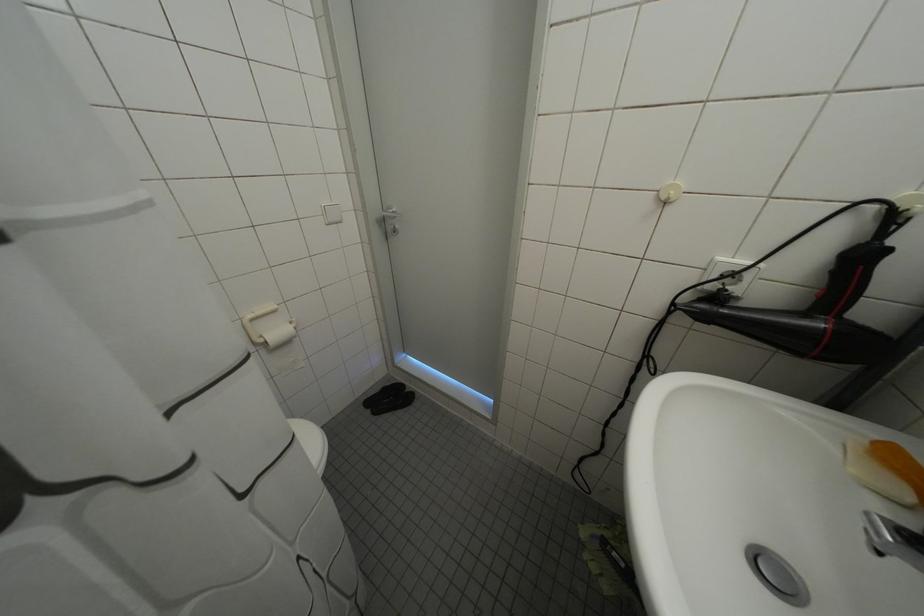
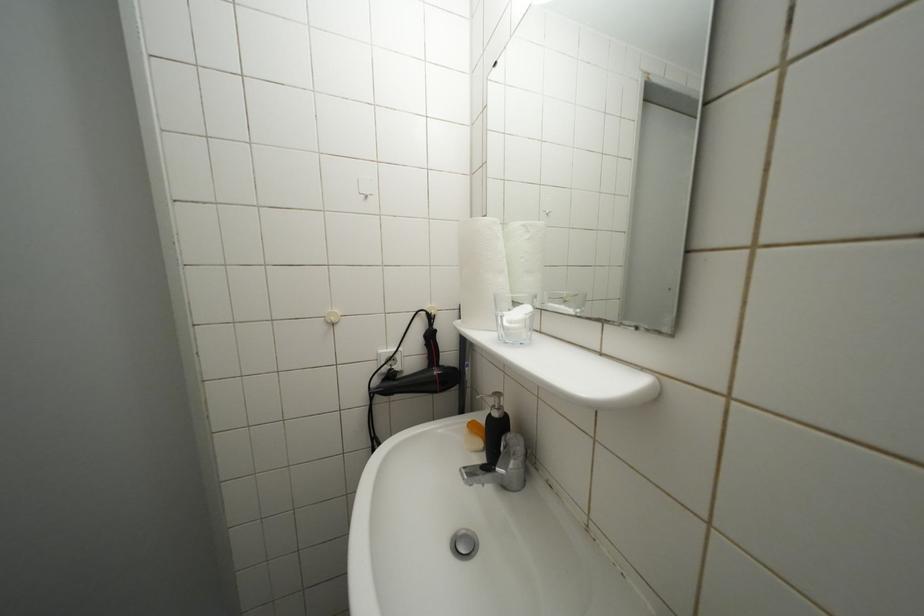
Question: The camera is either moving clockwise (left) or counter-clockwise (right) around the object. The first image is from the beginning of the video and the second image is from the end. Is the camera moving left or right when shooting the video?

Choices:
 (A) Left
 (B) Right

Answer: (A)